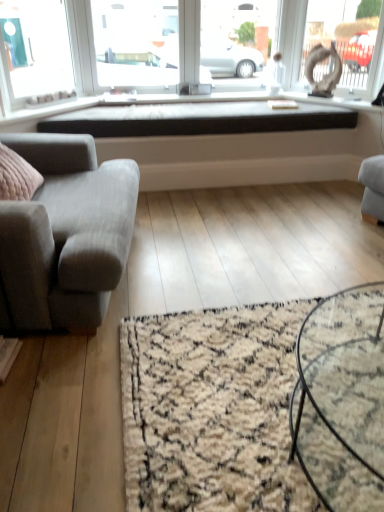
Question: Can you confirm if black matte window sill at center is wider than transparent glass window screen at upper center?

Choices:
 (A) no
 (B) yes

Answer: (B)

Question: Is black matte window sill at center closer to camera compared to transparent glass window screen at upper center?

Choices:
 (A) no
 (B) yes

Answer: (B)

Question: Is black matte window sill at center looking in the opposite direction of transparent glass window screen at upper center?

Choices:
 (A) no
 (B) yes

Answer: (A)

Question: Is there a large distance between black matte window sill at center and transparent glass window screen at upper center?

Choices:
 (A) no
 (B) yes

Answer: (A)

Question: Considering the relative sizes of black matte window sill at center and transparent glass window screen at upper center in the image provided, is black matte window sill at center taller than transparent glass window screen at upper center?

Choices:
 (A) no
 (B) yes

Answer: (A)

Question: Can you confirm if black matte window sill at center is thinner than transparent glass window screen at upper center?

Choices:
 (A) yes
 (B) no

Answer: (B)

Question: Does matte white statue at upper right have a greater width compared to gray fabric couch at left?

Choices:
 (A) yes
 (B) no

Answer: (B)

Question: Is matte white statue at upper right bigger than gray fabric couch at left?

Choices:
 (A) yes
 (B) no

Answer: (B)

Question: Is matte white statue at upper right in contact with gray fabric couch at left?

Choices:
 (A) no
 (B) yes

Answer: (A)

Question: From the image's perspective, is matte white statue at upper right beneath gray fabric couch at left?

Choices:
 (A) no
 (B) yes

Answer: (A)

Question: Is matte white statue at upper right completely or partially outside of gray fabric couch at left?

Choices:
 (A) no
 (B) yes

Answer: (B)

Question: Does matte white statue at upper right appear on the right side of gray fabric couch at left?

Choices:
 (A) no
 (B) yes

Answer: (B)

Question: Can you confirm if black glass coffee table at center is shorter than matte white statue at upper right?

Choices:
 (A) no
 (B) yes

Answer: (B)